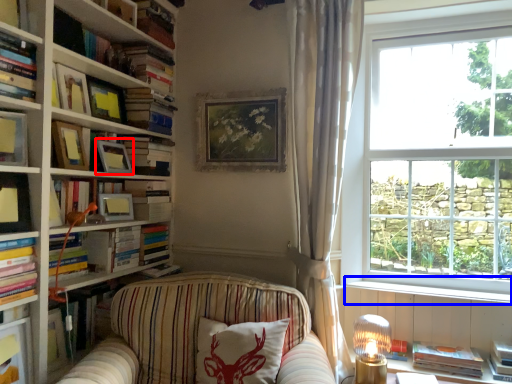
Question: Among these objects, which one is nearest to the camera, picture frame (highlighted by a red box) or window sill (highlighted by a blue box)?

Choices:
 (A) picture frame
 (B) window sill

Answer: (A)